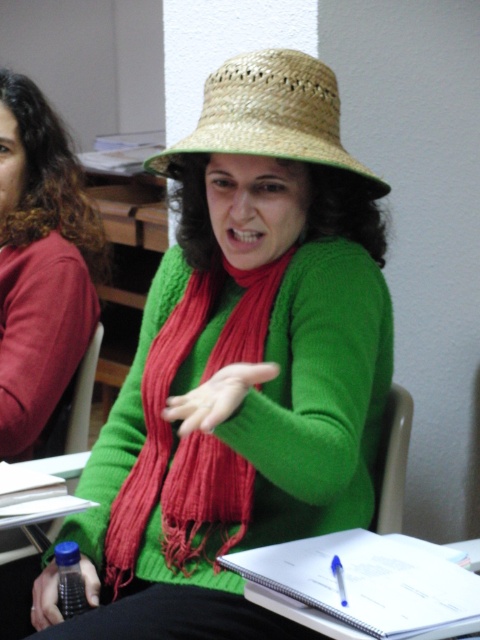
You are a delivery robot that needs to place a small package on the table between the natural straw hat at center and the smooth green hand at center. The package is 18 inches long. Will it fit between them?

The natural straw hat at center and smooth green hand at center are 17.73 inches apart, so the package that is 18 inches long will not fit between them.

You are a tailor measuring the width of two items on a table. You have a matte straw hat at center and a red knitted scarf at center. Which item has a greater width?

The matte straw hat at center has a greater width than the red knitted scarf at center according to the description.